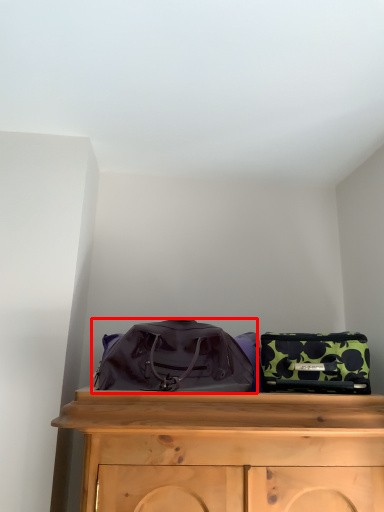
Question: Considering the relative positions of luggage and bags (annotated by the red box) and luggage and bags in the image provided, where is luggage and bags (annotated by the red box) located with respect to the staircase?

Choices:
 (A) right
 (B) left

Answer: (B)